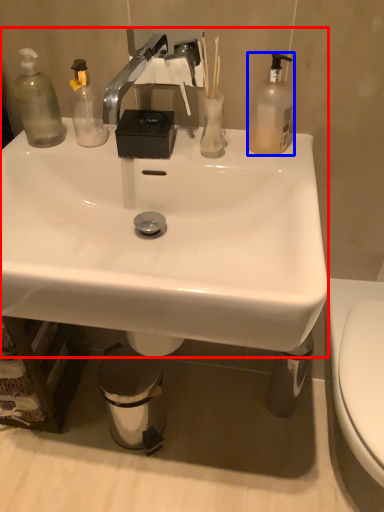
Question: Which point is further to the camera, sink (highlighted by a red box) or bottle (highlighted by a blue box)?

Choices:
 (A) sink
 (B) bottle

Answer: (B)